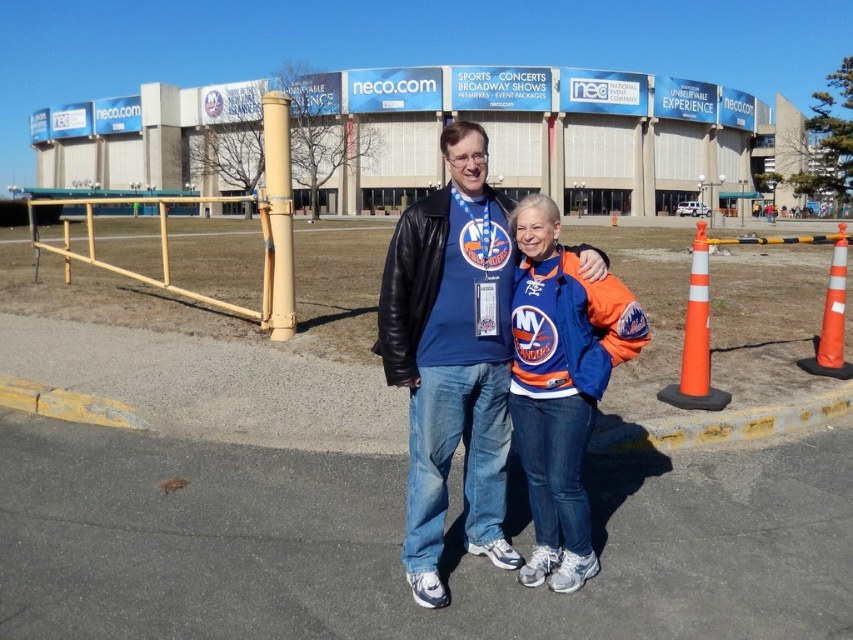
Can you confirm if blue jersey at center is thinner than orange/cone at right?

Yes.

Measure the distance from blue jersey at center to orange/cone at right.

The distance of blue jersey at center from orange/cone at right is 3.36 meters.

Which is in front, point (519, 557) or point (726, 403)?

Point (519, 557) is more forward.

Where is `blue jersey at center`? blue jersey at center is located at coordinates (451, 356).

Who is higher up, blue jersey at center or orange/reflective traffic cone at right?

orange/reflective traffic cone at right

Is blue jersey at center to the right of orange/reflective traffic cone at right from the viewer's perspective?

Incorrect, blue jersey at center is not on the right side of orange/reflective traffic cone at right.

In order to click on blue jersey at center in this screenshot , I will do `click(451, 356)`.

Is blue fleece jacket at center thinner than orange/reflective traffic cone at right?

Correct, blue fleece jacket at center's width is less than orange/reflective traffic cone at right's.

Is point (587, 568) behind point (842, 236)?

No.

Where is `blue fleece jacket at center`? Image resolution: width=853 pixels, height=640 pixels. blue fleece jacket at center is located at coordinates (560, 385).